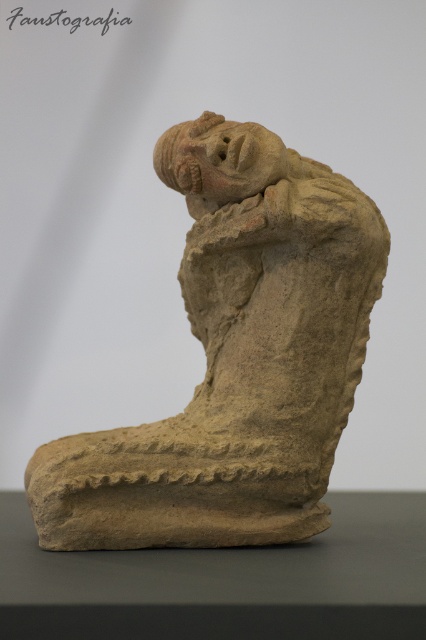
Find the location of a particular element. This screenshot has height=640, width=426. earthy clay figure at center is located at coordinates (236, 358).

Locate an element on the screen. The width and height of the screenshot is (426, 640). earthy clay figure at center is located at coordinates (236, 358).

You are a GUI agent. You are given a task and a screenshot of the screen. Output one action in this format:
    pyautogui.click(x=<x>, y=<y>)
    Task: Click on the earthy clay figure at center
    
    Given the screenshot: What is the action you would take?
    pyautogui.click(x=236, y=358)